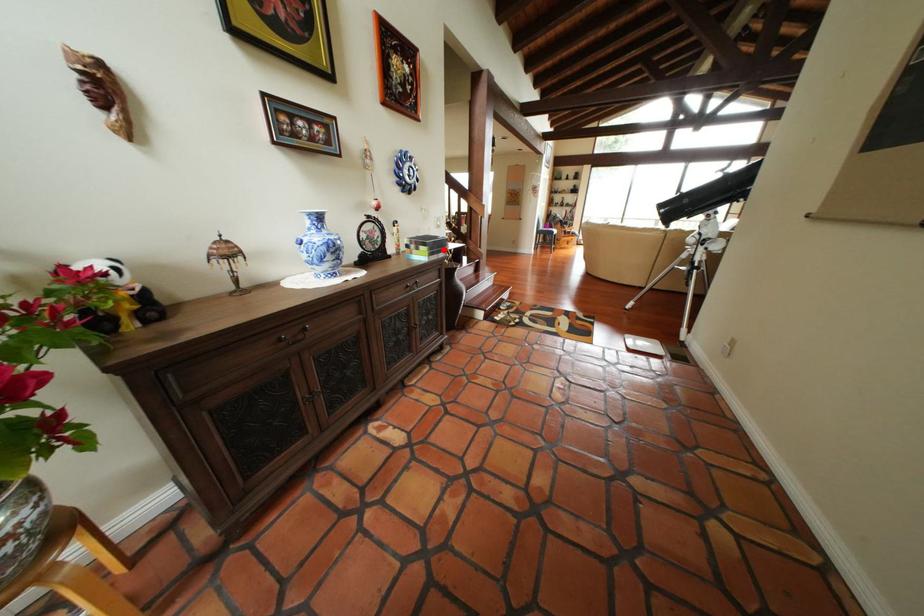
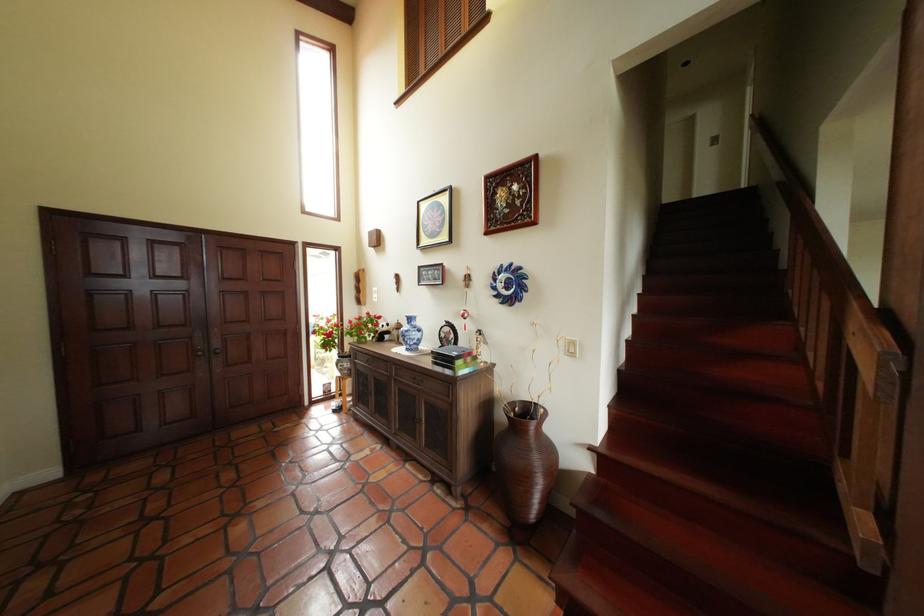
Find the pixel in the second image that matches the highlighted location in the first image.

(448, 360)